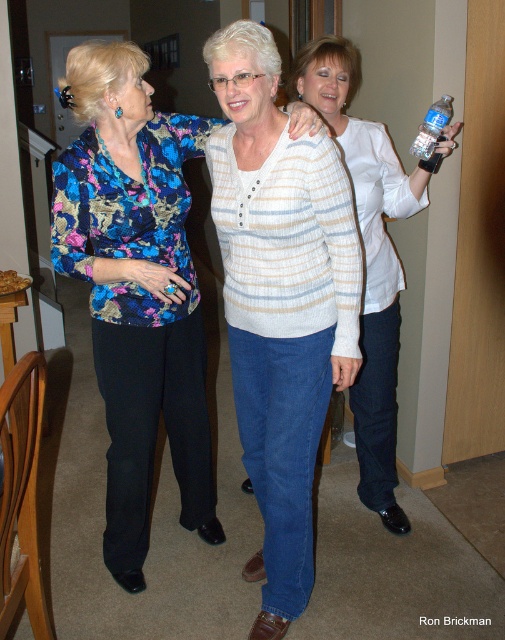
Question: Is white striped sweater at center below floral-patterned blouse at center?

Choices:
 (A) yes
 (B) no

Answer: (A)

Question: Which point is farther from the camera taking this photo?

Choices:
 (A) pyautogui.click(x=65, y=232)
 (B) pyautogui.click(x=436, y=104)
 (C) pyautogui.click(x=349, y=88)
 (D) pyautogui.click(x=315, y=364)

Answer: (C)

Question: Does white matte jacket at center have a greater width compared to clear plastic bottle at upper right?

Choices:
 (A) yes
 (B) no

Answer: (A)

Question: Does white striped sweater at center appear over white matte jacket at center?

Choices:
 (A) no
 (B) yes

Answer: (A)

Question: Which point is closer to the camera?

Choices:
 (A) floral-patterned blouse at center
 (B) clear plastic bottle at upper right
 (C) white matte jacket at center

Answer: (A)

Question: Which object appears farthest from the camera in this image?

Choices:
 (A) white matte jacket at center
 (B) floral-patterned blouse at center
 (C) white striped sweater at center

Answer: (A)